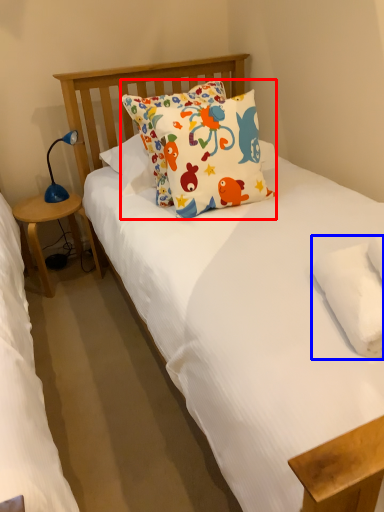
Question: Which of the following is the closest to the observer, pillow (highlighted by a red box) or pillow (highlighted by a blue box)?

Choices:
 (A) pillow
 (B) pillow

Answer: (B)